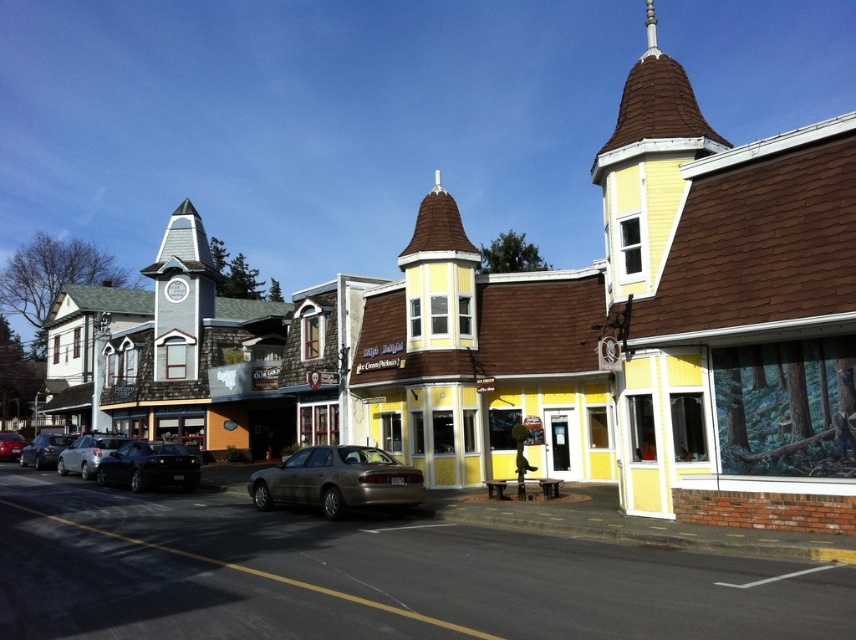
Question: Is yellow wood building at center smaller than shiny black sedan at left?

Choices:
 (A) no
 (B) yes

Answer: (A)

Question: Which point is farther to the camera?

Choices:
 (A) (4, 445)
 (B) (64, 436)
 (C) (74, 460)
 (D) (355, 470)

Answer: (A)

Question: Which object is closer to the camera taking this photo?

Choices:
 (A) shiny black sedan at left
 (B) matte black sedan at left
 (C) yellow wood building at center
 (D) silver metallic sedan at left

Answer: (C)

Question: Does shiny black sedan at left have a larger size compared to matte black sedan at left?

Choices:
 (A) yes
 (B) no

Answer: (B)

Question: Is gold metallic sedan at center to the right of silver metallic sedan at left from the viewer's perspective?

Choices:
 (A) no
 (B) yes

Answer: (B)

Question: Which point is farther to the camera?

Choices:
 (A) shiny black sedan at left
 (B) yellow wood building at center
 (C) matte black sedan at left

Answer: (C)